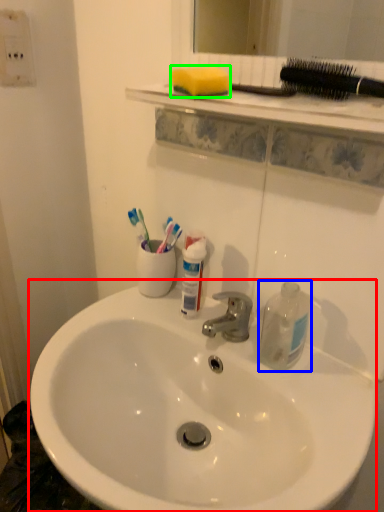
Question: Which is farther away from sink (highlighted by a red box)? cleaning product (highlighted by a blue box) or soap (highlighted by a green box)?

Choices:
 (A) cleaning product
 (B) soap

Answer: (B)